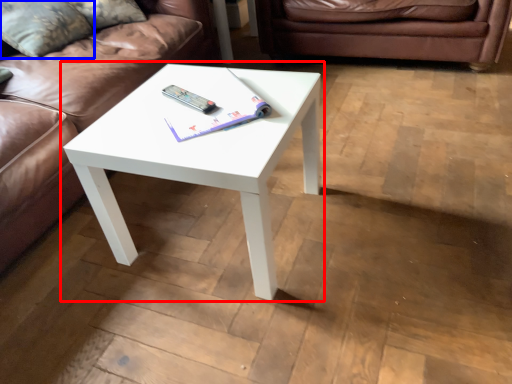
Question: Which object appears farthest to the camera in this image, coffee table (highlighted by a red box) or pillow (highlighted by a blue box)?

Choices:
 (A) coffee table
 (B) pillow

Answer: (B)